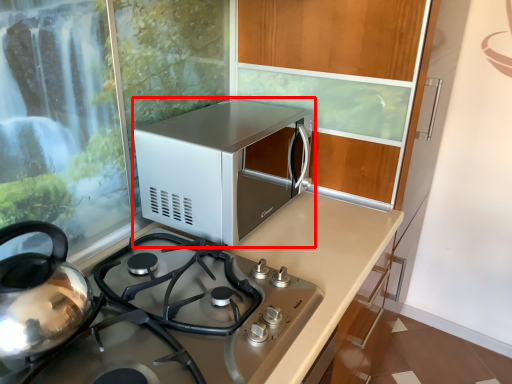
Question: From the image's perspective, where is microwave oven (annotated by the red box) located relative to countertop?

Choices:
 (A) below
 (B) above

Answer: (B)